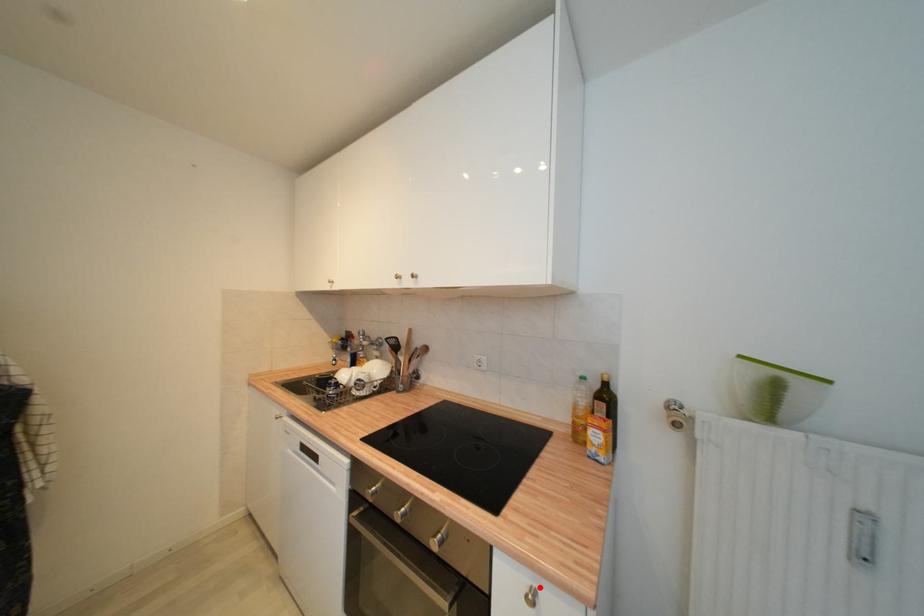
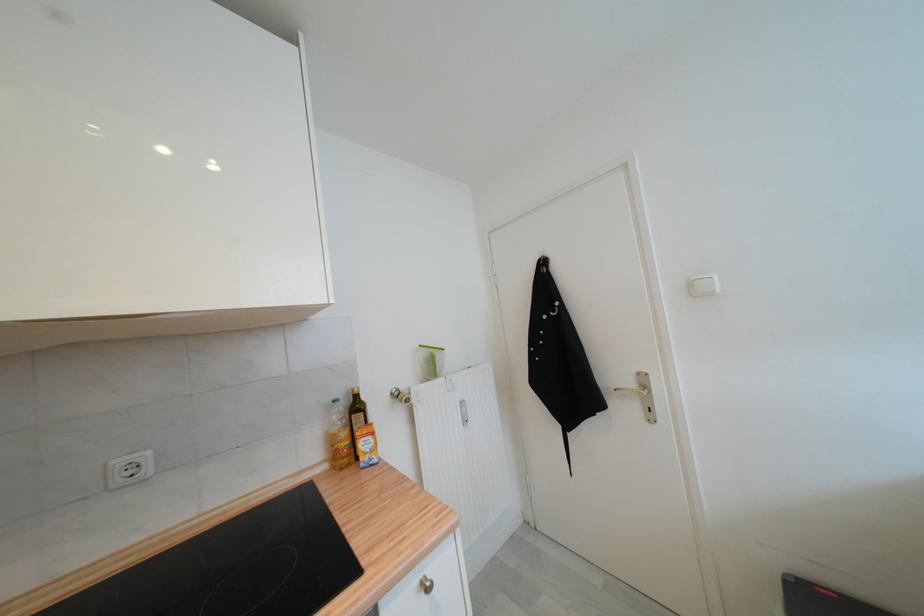
The point at the highlighted location is marked in the first image. Where is the corresponding point in the second image?

(427, 578)